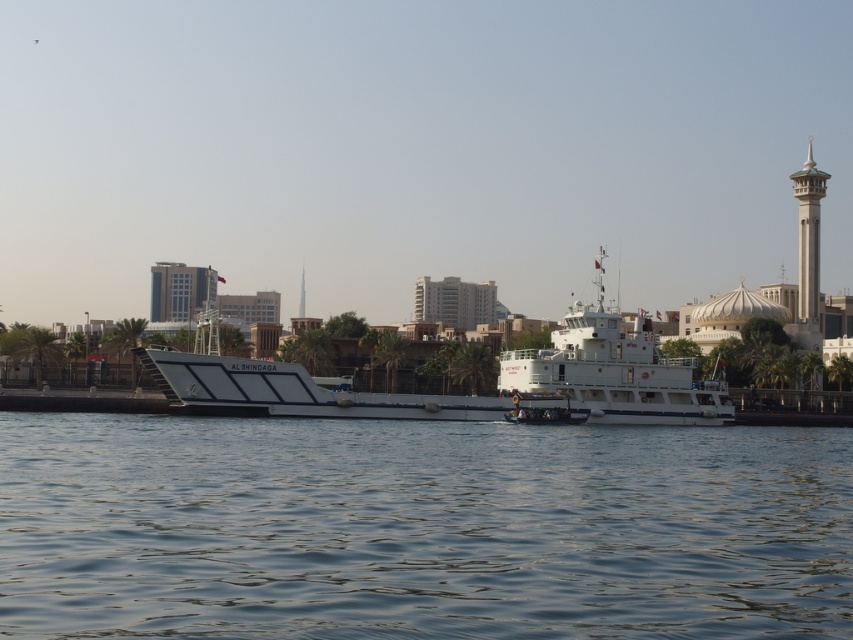
You are a photographer planning to capture the white stone minaret at upper right and the clear water at center in a single shot. Considering their positions, which object will appear taller in the photograph?

The white stone minaret at upper right will appear taller in the photograph because it has a greater height than the clear water at center according to the description.

You are a tourist standing on the shore looking at the white matte ferry at center and the white stone minaret at upper right. Which object is closer to you?

The white matte ferry at center is closer to you because it is positioned under the white stone minaret at upper right, indicating it is in front of the minaret.

You are a photographer planning to capture a wide shot of the waterfront scene. You need to ensure that both the white matte boat at center and the white stone minaret at upper right are fully visible in your frame. Given their sizes, which object should you position closer to the edge of the frame to avoid overcrowding the composition?

Since the white matte boat at center is wider than the white stone minaret at upper right, you should position the wider white matte boat at center closer to the edge of the frame to prevent it from overwhelming the composition and ensure both elements are fully visible.